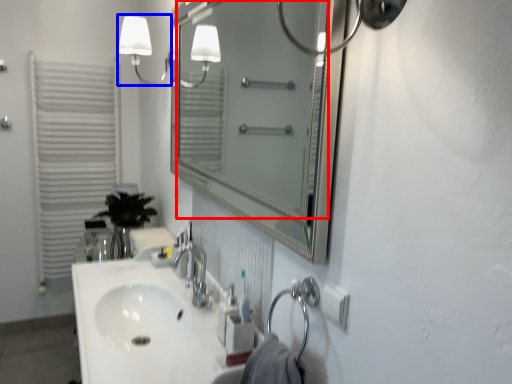
Question: Which object is closer to the camera taking this photo, mirror (highlighted by a red box) or light fixture (highlighted by a blue box)?

Choices:
 (A) mirror
 (B) light fixture

Answer: (A)